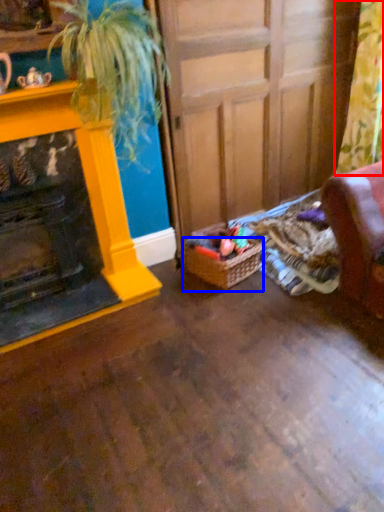
Question: Which object is closer to the camera taking this photo, curtain (highlighted by a red box) or basket (highlighted by a blue box)?

Choices:
 (A) curtain
 (B) basket

Answer: (A)